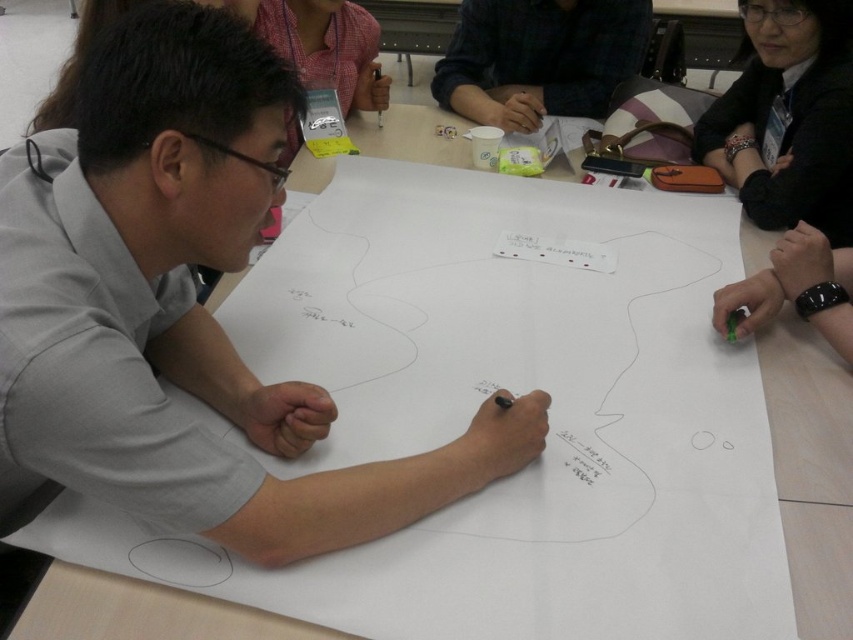
You are standing in front of the table where the group is working. If you want to place a new item at the same 2D location as the black leather jacket at upper right, which object should you reference to ensure correct placement?

→ The black leather jacket at upper right is located at point (788, 116), so you should place the new item at those coordinates to match its position.

You are organizing a clothing drive and need to decide which items can fit into a storage box that can hold items up to 1 meter in width. Based on the scene, which of the two items, the black leather jacket at upper right or the dark plaid shirt at upper center, is more likely to fit into the box?

The black leather jacket at upper right has a lesser width compared to the dark plaid shirt at upper center, so the black leather jacket at upper right is more likely to fit into the storage box since its width is smaller than the 1 meter limit.

You are an observer looking at the scene. There is a black leather jacket at upper right and a dark plaid shirt at upper center. Which object is positioned lower in the image?

The black leather jacket at upper right is located below the dark plaid shirt at upper center, so it is positioned lower in the image.